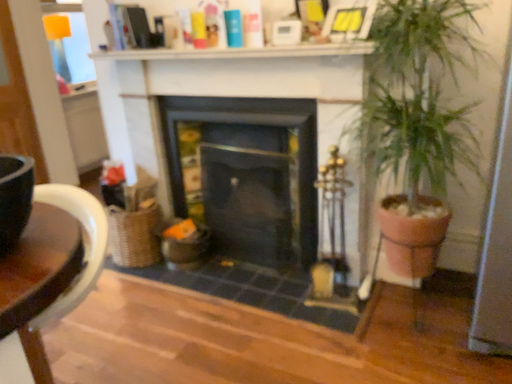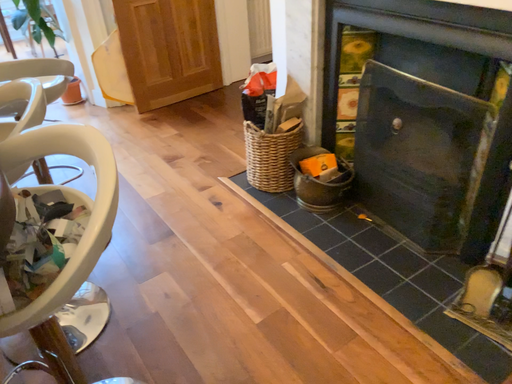
Question: How did the camera likely rotate when shooting the video?

Choices:
 (A) rotated upward
 (B) rotated downward

Answer: (B)